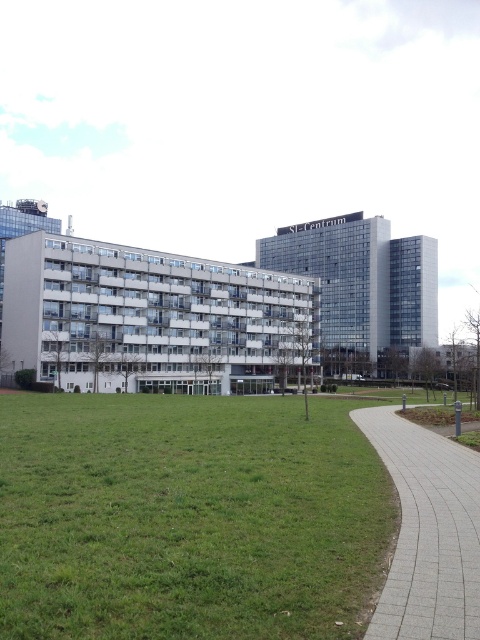
Can you confirm if white concrete building at center is positioned below gray concrete pavement at lower right?

Actually, white concrete building at center is above gray concrete pavement at lower right.

Is white concrete building at center taller than gray concrete pavement at lower right?

Yes.

Find the location of `white concrete building at center`. white concrete building at center is located at coordinates tap(153, 320).

Does green grass at lower left appear over white concrete building at center?

No.

Who is taller, green grass at lower left or white concrete building at center?

white concrete building at center

Is point (238, 460) closer to camera compared to point (152, 275)?

That is True.

I want to click on green grass at lower left, so click(187, 518).

Is point (463, 611) positioned behind point (323, 250)?

No, (463, 611) is closer to viewer.

Can you confirm if gray concrete pavement at lower right is bigger than glassy steel building at center?

Actually, gray concrete pavement at lower right might be smaller than glassy steel building at center.

Is point (387, 444) positioned after point (393, 324)?

No, (387, 444) is in front of (393, 324).

The width and height of the screenshot is (480, 640). Identify the location of gray concrete pavement at lower right. (428, 531).